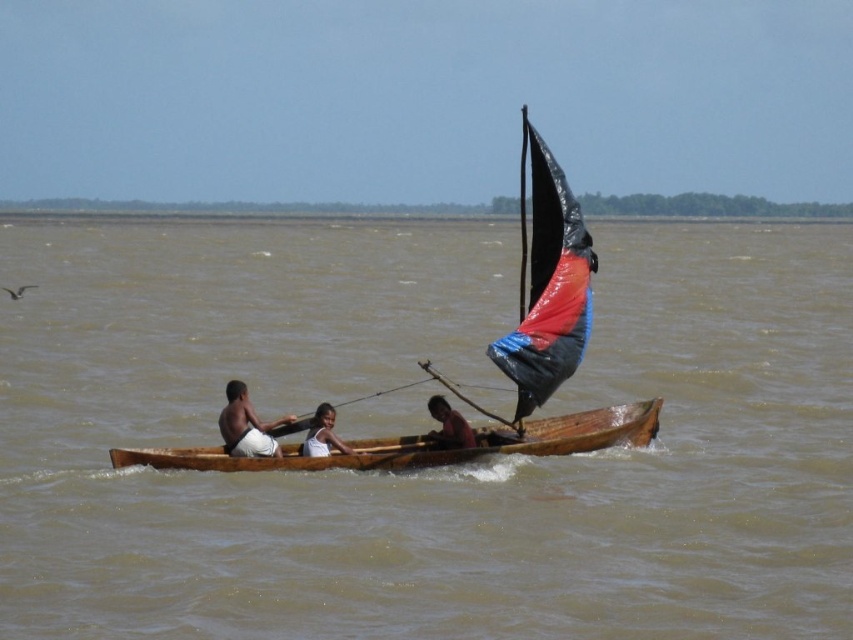
You are a passenger on the boat and need to reach the white fabric shirt at center to grab a life jacket. Can you easily access it without moving past the black plastic sail at upper right?

The black plastic sail at upper right is located above the white fabric shirt at center, so you can easily access the white fabric shirt at center without moving past the sail.

Consider the image. You are a sailor trying to determine if the black plastic sail at upper right can be folded into a storage compartment designed to hold items no wider than the white fabric shirt at center. Based on their sizes, will it fit?

The black plastic sail at upper right is wider than the white fabric shirt at center, so it will not fit into the storage compartment designed for items no wider than the white fabric shirt at center.

You are a photographer standing on the shore and want to take a photo of the light brown skin at center. Based on the distance provided, what is the minimum focal length required to capture the subject clearly without distortion?

The minimum focal length required to capture the light brown skin at center clearly without distortion would depend on the camera sensor size and desired framing. However, since the subject is 30.20 meters away, a longer focal length like 200mm or higher is typically recommended to reduce distortion and ensure clarity at that distance.